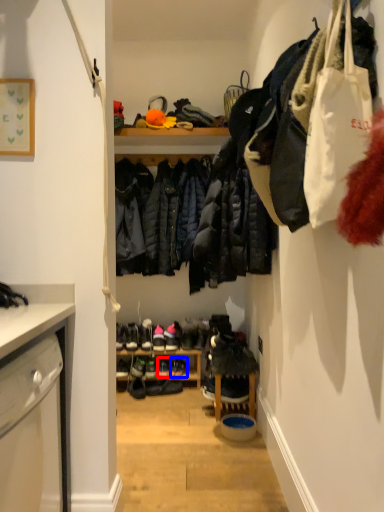
Question: Which object is further to the camera taking this photo, footwear (highlighted by a red box) or footwear (highlighted by a blue box)?

Choices:
 (A) footwear
 (B) footwear

Answer: (B)